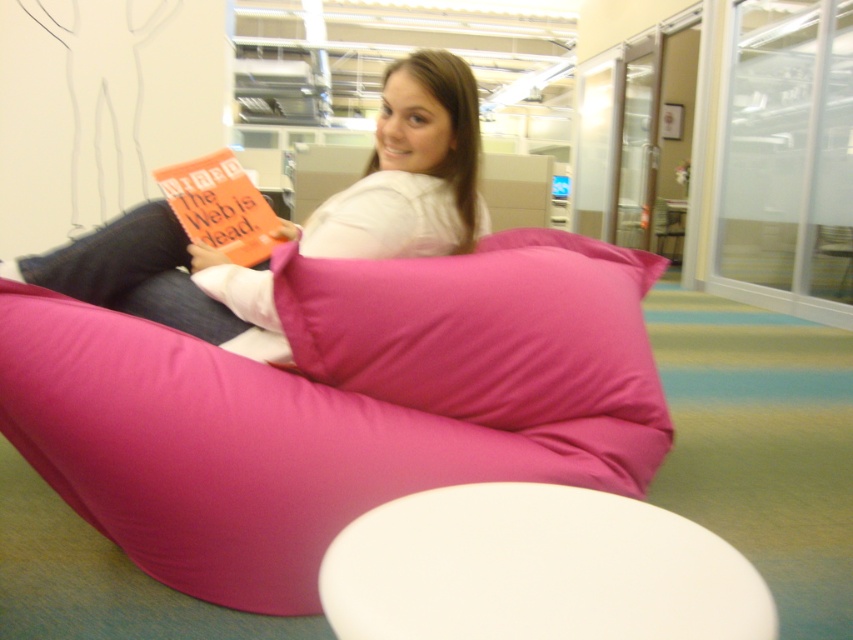
Question: Can you confirm if fuchsia fabric bean bag at center is thinner than matte pink bean bag at center?

Choices:
 (A) no
 (B) yes

Answer: (A)

Question: Is matte pink bean bag at center behind orange matte book at upper left?

Choices:
 (A) no
 (B) yes

Answer: (A)

Question: Which of the following is the farthest from the observer?

Choices:
 (A) (227, 216)
 (B) (165, 250)
 (C) (381, 426)

Answer: (A)

Question: Can you confirm if fuchsia fabric bean bag at center is positioned below orange matte book at upper left?

Choices:
 (A) no
 (B) yes

Answer: (B)

Question: Which of the following is the closest to the observer?

Choices:
 (A) (74, 492)
 (B) (258, 220)
 (C) (421, 170)
 (D) (328, 381)

Answer: (D)

Question: Which point is closer to the camera?

Choices:
 (A) (531, 374)
 (B) (318, 608)
 (C) (244, 257)

Answer: (A)